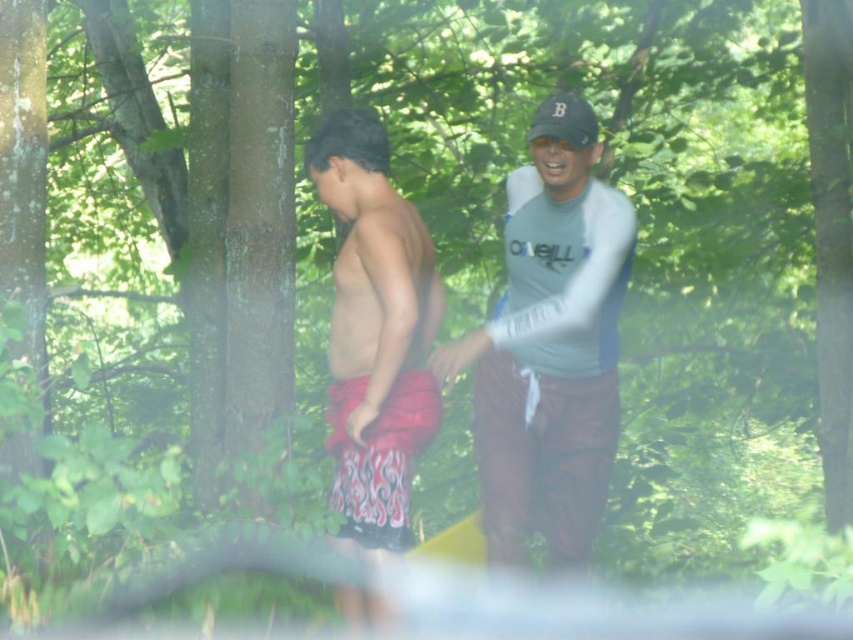
Question: Which point is closer to the camera taking this photo?

Choices:
 (A) (572, 129)
 (B) (361, 528)
 (C) (339, 307)
 (D) (520, 212)

Answer: (A)

Question: Observing the image, what is the correct spatial positioning of gray-blue fabric shirt at center in reference to printed fabric shorts at center?

Choices:
 (A) left
 (B) right

Answer: (B)

Question: In this image, where is reddish-patterned shorts at center located relative to black fabric baseball cap at upper right?

Choices:
 (A) right
 (B) left

Answer: (B)

Question: Does reddish-patterned shorts at center appear over black fabric baseball cap at upper right?

Choices:
 (A) yes
 (B) no

Answer: (B)

Question: Considering the real-world distances, which object is farthest from the black fabric baseball cap at upper right?

Choices:
 (A) gray-blue fabric shirt at center
 (B) printed fabric shorts at center
 (C) reddish-patterned shorts at center

Answer: (B)

Question: Estimate the real-world distances between objects in this image. Which object is closer to the black fabric baseball cap at upper right?

Choices:
 (A) gray-blue fabric shirt at center
 (B) reddish-patterned shorts at center

Answer: (A)